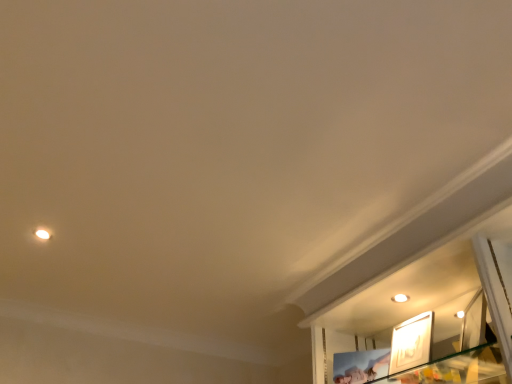
Question: Should I look upward or downward to see white glossy picture frame at upper right?

Choices:
 (A) up
 (B) down

Answer: (B)